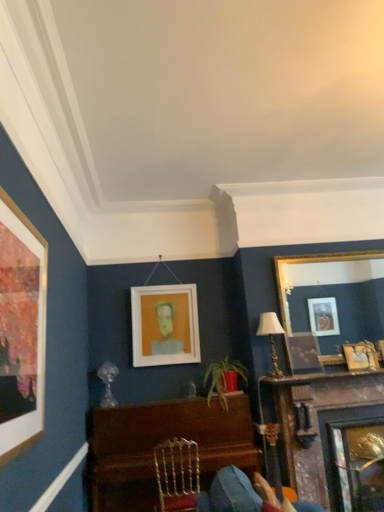
You are a GUI agent. You are given a task and a screenshot of the screen. Output one action in this format:
    pyautogui.click(x=<x>, y=<y>)
    Task: Click on the polished wood piano at center
    
    Given the screenshot: What is the action you would take?
    pyautogui.click(x=161, y=442)

In the scene shown: Measure the distance between point (376, 362) and camera.

Point (376, 362) is 3.78 meters from camera.

What do you see at coordinates (361, 356) in the screenshot? This screenshot has width=384, height=512. I see `matte gold picture frame at upper right, marked as the 1th picture frame in a right-to-left arrangement` at bounding box center [361, 356].

Describe the element at coordinates (318, 424) in the screenshot. I see `dark wood fireplace at lower right` at that location.

At what (x,y) coordinates should I click in order to perform the action: click on gold metallic chair at center. Please return your answer as a coordinate pair (x, y). Looking at the image, I should click on (177, 474).

Describe the element at coordinates (165, 325) in the screenshot. This screenshot has width=384, height=512. I see `white matte picture frame at upper center, which is the 4th picture frame from right to left` at that location.

This screenshot has width=384, height=512. I want to click on polished wood piano at center, so click(x=161, y=442).

Considering the sizes of white matte picture frame at upper center, which is the 4th picture frame from right to left, and polished wood piano at center in the image, is white matte picture frame at upper center, which is the 4th picture frame from right to left, bigger or smaller than polished wood piano at center?

Clearly, white matte picture frame at upper center, which is the 4th picture frame from right to left, is smaller in size than polished wood piano at center.

The width and height of the screenshot is (384, 512). What are the coordinates of `the 3rd picture frame above the polished wood piano at center (from the image's perspective)` in the screenshot? It's located at (165, 325).

Does white matte picture frame at upper center, which is the 4th picture frame from right to left, turn towards polished wood piano at center?

No.

Is point (174, 313) positioned in front of point (111, 494)?

No.

How many degrees apart are the facing directions of gold/gilded mirror at upper right, the 3th picture frame in the left-to-right sequence, and white matte picture frame at upper center, which is the 4th picture frame from right to left?

There is a 0.00104-degree angle between the facing directions of gold/gilded mirror at upper right, the 3th picture frame in the left-to-right sequence, and white matte picture frame at upper center, which is the 4th picture frame from right to left.

Between gold/gilded mirror at upper right, the 3th picture frame in the left-to-right sequence, and white matte picture frame at upper center, the first picture frame positioned from the left, which one has less height?

With less height is gold/gilded mirror at upper right, the 3th picture frame in the left-to-right sequence.

Which object is wider, gold/gilded mirror at upper right, the 2th picture frame from the right, or white matte picture frame at upper center, which is the 4th picture frame from right to left?

Wider between the two is white matte picture frame at upper center, which is the 4th picture frame from right to left.

The height and width of the screenshot is (512, 384). What are the coordinates of `the 2nd picture frame in front when counting from the white matte picture frame at upper center, which is the 4th picture frame from right to left` in the screenshot? It's located at (330, 302).

From the image's perspective, between matte gold picture frame at upper right, the fourth picture frame viewed from the left, and dark wood fireplace at lower right, who is located below?

From the image's view, dark wood fireplace at lower right is below.

Which is closer, (371, 359) or (320, 447)?

The point (320, 447) is in front.

Are matte gold picture frame at upper right, the fourth picture frame viewed from the left, and dark wood fireplace at lower right beside each other?

No, matte gold picture frame at upper right, the fourth picture frame viewed from the left, is not in contact with dark wood fireplace at lower right.

Where is `furniture below the white matte picture frame at upper center, the first picture frame positioned from the left (from the image's perspective)`? The width and height of the screenshot is (384, 512). furniture below the white matte picture frame at upper center, the first picture frame positioned from the left (from the image's perspective) is located at coordinates (161, 442).

From a real-world perspective, is polished wood piano at center physically located above or below white matte picture frame at upper center, the first picture frame positioned from the left?

polished wood piano at center is below white matte picture frame at upper center, the first picture frame positioned from the left.

Could you tell me if polished wood piano at center is facing white matte picture frame at upper center, the first picture frame positioned from the left?

No, polished wood piano at center is not turned towards white matte picture frame at upper center, the first picture frame positioned from the left.

Visually, is polished wood piano at center positioned to the left or to the right of white matte picture frame at upper center, the first picture frame positioned from the left?

Based on their positions, polished wood piano at center is located to the right of white matte picture frame at upper center, the first picture frame positioned from the left.

Which object is thinner, matte gold lampshade at upper right or polished wood piano at center?

With smaller width is matte gold lampshade at upper right.

Is point (278, 373) closer to viewer compared to point (119, 505)?

No.

From the image's perspective, which object appears higher, matte gold lampshade at upper right or polished wood piano at center?

matte gold lampshade at upper right, from the image's perspective.

How different are the orientations of matte gold lampshade at upper right and polished wood piano at center in degrees?

The angle between the facing direction of matte gold lampshade at upper right and the facing direction of polished wood piano at center is 0.439 degrees.

Between gold/gilded mirror at upper right, the 3th picture frame in the left-to-right sequence, and gold metallic chair at center, which one appears on the right side from the viewer's perspective?

Positioned to the right is gold/gilded mirror at upper right, the 3th picture frame in the left-to-right sequence.

Is gold metallic chair at center at the back of gold/gilded mirror at upper right, the 2th picture frame from the right?

gold/gilded mirror at upper right, the 2th picture frame from the right, does not have its back to gold metallic chair at center.

Is gold metallic chair at center surrounded by gold/gilded mirror at upper right, the 3th picture frame in the left-to-right sequence?

No, gold metallic chair at center is not surrounded by gold/gilded mirror at upper right, the 3th picture frame in the left-to-right sequence.

Is matte gold picture frame at upper right, the fourth picture frame viewed from the left, turned away from gold metallic chair at center?

matte gold picture frame at upper right, the fourth picture frame viewed from the left, is not turned away from gold metallic chair at center.

Consider the image. Which is in front, matte gold picture frame at upper right, the fourth picture frame viewed from the left, or gold metallic chair at center?

gold metallic chair at center.

Is matte gold picture frame at upper right, marked as the 1th picture frame in a right-to-left arrangement, to the right of gold metallic chair at center from the viewer's perspective?

Yes.

From the image's perspective, count 3rd picture frames upward from the polished wood piano at center and point to it. Please provide its 2D coordinates.

[(165, 325)]

Where is `the 1st picture frame located beneath the white matte picture frame at upper center, which is the 4th picture frame from right to left (from a real-world perspective)`? The image size is (384, 512). the 1st picture frame located beneath the white matte picture frame at upper center, which is the 4th picture frame from right to left (from a real-world perspective) is located at coordinates (330, 302).

Looking at the image, which one is located closer to white matte picture frame at upper center, the first picture frame positioned from the left, polished wood piano at center or gold/gilded mirror at upper right, the 2th picture frame from the right?

The object closer to white matte picture frame at upper center, the first picture frame positioned from the left, is polished wood piano at center.

Considering their positions, is dark wood fireplace at lower right positioned closer to gold/gilded mirror at upper right, the 2th picture frame from the right, than white matte picture frame at upper center, which is the 4th picture frame from right to left?

dark wood fireplace at lower right is positioned closer to the anchor gold/gilded mirror at upper right, the 2th picture frame from the right.

Based on their spatial positions, is dark wood fireplace at lower right or white matte picture frame at upper center, which is the 4th picture frame from right to left, closer to polished wood piano at center?

dark wood fireplace at lower right.

From the image, which object appears to be nearer to matte gold lampshade at upper right, polished wood piano at center or matte gold picture frame at upper right, the fourth picture frame viewed from the left?

matte gold picture frame at upper right, the fourth picture frame viewed from the left.

From the image, which object appears to be nearer to polished wood piano at center, gold metallic chair at center or matte gold picture frame at upper right, marked as the 1th picture frame in a right-to-left arrangement?

The object closer to polished wood piano at center is gold metallic chair at center.

Estimate the real-world distances between objects in this image. Which object is further from gold metallic chair at center, matte wooden picture frame at upper right, the 3th picture frame in the right-to-left sequence, or white matte picture frame at upper center, which is the 4th picture frame from right to left?

The object further to gold metallic chair at center is matte wooden picture frame at upper right, the 3th picture frame in the right-to-left sequence.

Considering their positions, is gold/gilded mirror at upper right, the 2th picture frame from the right, positioned further to dark wood fireplace at lower right than polished wood piano at center?

Among the two, gold/gilded mirror at upper right, the 2th picture frame from the right, is located further to dark wood fireplace at lower right.

When comparing their distances from polished wood piano at center, does matte gold lampshade at upper right or white matte picture frame at upper center, the first picture frame positioned from the left, seem closer?

Among the two, white matte picture frame at upper center, the first picture frame positioned from the left, is located nearer to polished wood piano at center.

The height and width of the screenshot is (512, 384). I want to click on lamp between gold metallic chair at center and matte wooden picture frame at upper right, the 3th picture frame in the right-to-left sequence, from left to right, so click(x=271, y=337).

Locate an element on the screen. chair between polished wood piano at center and matte wooden picture frame at upper right, the 2th picture frame viewed from the left, in the horizontal direction is located at coordinates (177, 474).

This screenshot has width=384, height=512. In order to click on lamp between gold metallic chair at center and dark wood fireplace at lower right in the horizontal direction in this screenshot , I will do `click(271, 337)`.

What are the coordinates of `lamp that lies between white matte picture frame at upper center, which is the 4th picture frame from right to left, and polished wood piano at center from top to bottom` in the screenshot? It's located at (271, 337).